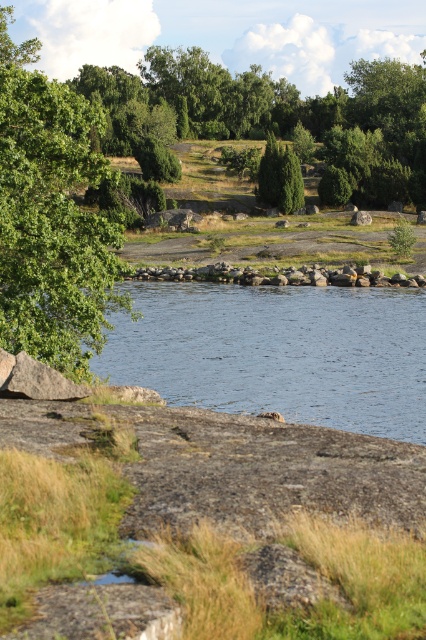
Can you confirm if clear water at center is positioned below gray rock wall at center?

Correct, clear water at center is located below gray rock wall at center.

Which is in front, point (356, 368) or point (235, 273)?

Positioned in front is point (356, 368).

Between point (123, 330) and point (232, 280), which one is positioned behind?

Point (232, 280)

Image resolution: width=426 pixels, height=640 pixels. Identify the location of clear water at center. (278, 352).

Is green leafy tree at left wider than gray rock wall at center?

No, green leafy tree at left is not wider than gray rock wall at center.

Between point (9, 208) and point (158, 269), which one is positioned in front?

Positioned in front is point (9, 208).

The height and width of the screenshot is (640, 426). What do you see at coordinates (51, 218) in the screenshot?
I see `green leafy tree at left` at bounding box center [51, 218].

This screenshot has height=640, width=426. I want to click on green leafy tree at left, so click(x=51, y=218).

Between clear water at center and green leafy tree at left, which one has more height?

With more height is green leafy tree at left.

What do you see at coordinates (278, 352) in the screenshot? Image resolution: width=426 pixels, height=640 pixels. I see `clear water at center` at bounding box center [278, 352].

Where is `clear water at center`? clear water at center is located at coordinates (278, 352).